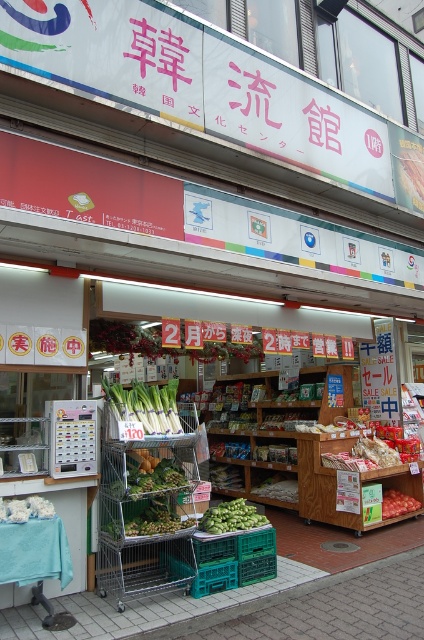
You are standing in front of the grocery store and want to take a photo of the green matte leek at center. If your camera has a maximum focus distance of 5 meters, will it be able to capture the leek clearly?

The green matte leek at center and camera are 4.66 meters apart from each other, so the camera can focus on the leek since the distance is within the 5 meter limit.

You are a customer standing in front of the grocery store and see both the green matte leek at center and the smooth red tomato at center. Which vegetable is closer to you?

The green matte leek at center is closer to you since it is positioned in front of the smooth red tomato at center.